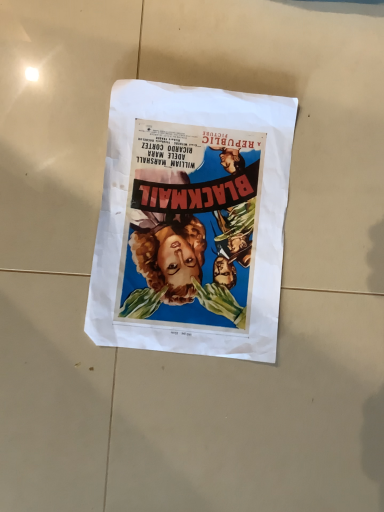
Image resolution: width=384 pixels, height=512 pixels. What do you see at coordinates (192, 221) in the screenshot?
I see `matte paper poster at center` at bounding box center [192, 221].

Where is `matte paper poster at center`? Image resolution: width=384 pixels, height=512 pixels. matte paper poster at center is located at coordinates (192, 221).

Identify the location of matte paper poster at center. (192, 221).